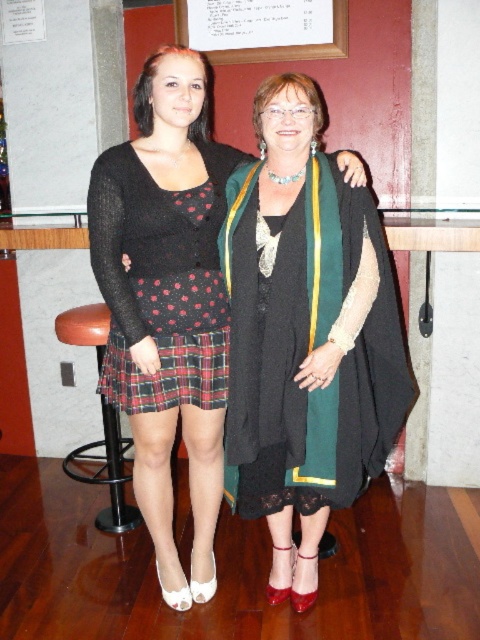
Does matte black sweater at center have a greater height compared to black lace dress at center?

Yes.

The width and height of the screenshot is (480, 640). I want to click on matte black sweater at center, so point(167,301).

Who is more forward, (140,163) or (317,252)?

Point (317,252)

You are a GUI agent. You are given a task and a screenshot of the screen. Output one action in this format:
    pyautogui.click(x=<x>, y=<y>)
    Task: Click on the matte black sweater at center
    The image size is (480, 640).
    Given the screenshot: What is the action you would take?
    pyautogui.click(x=167, y=301)

Does matte black sweater at center appear on the right side of white paper at upper center?

Incorrect, matte black sweater at center is not on the right side of white paper at upper center.

Does matte black sweater at center come behind white paper at upper center?

No, matte black sweater at center is in front of white paper at upper center.

This screenshot has height=640, width=480. Describe the element at coordinates (167, 301) in the screenshot. I see `matte black sweater at center` at that location.

You are a GUI agent. You are given a task and a screenshot of the screen. Output one action in this format:
    pyautogui.click(x=<x>, y=<y>)
    Task: Click on the matte black sweater at center
    
    Given the screenshot: What is the action you would take?
    pyautogui.click(x=167, y=301)

Consider the image. Which is above, black lace dress at center or plaid fabric skirt at lower center?

black lace dress at center is above.

Can you confirm if black lace dress at center is smaller than plaid fabric skirt at lower center?

No.

Who is more distant from viewer, (x=309, y=172) or (x=116, y=392)?

The point (x=116, y=392) is more distant.

You are a GUI agent. You are given a task and a screenshot of the screen. Output one action in this format:
    pyautogui.click(x=<x>, y=<y>)
    Task: Click on the black lace dress at center
    
    Given the screenshot: What is the action you would take?
    pyautogui.click(x=307, y=348)